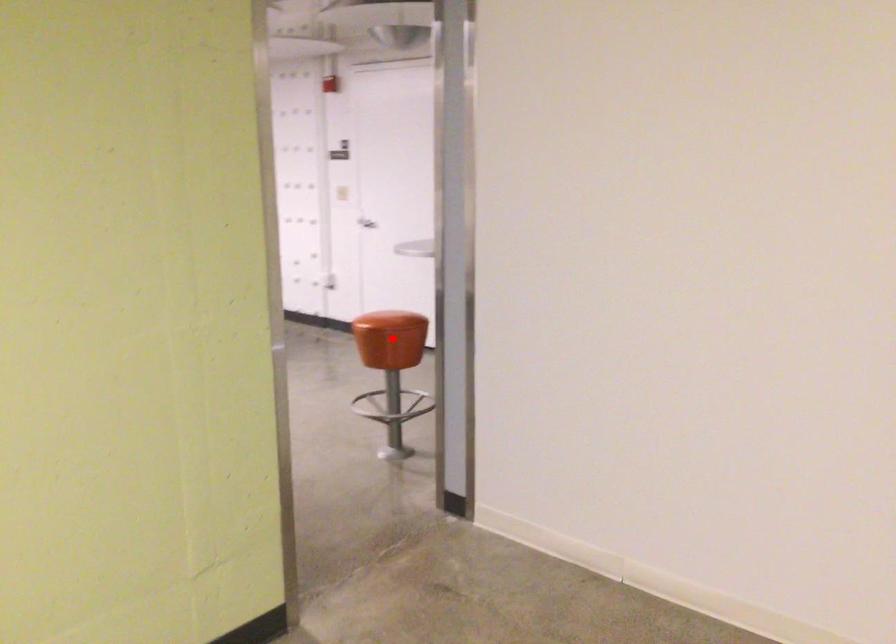
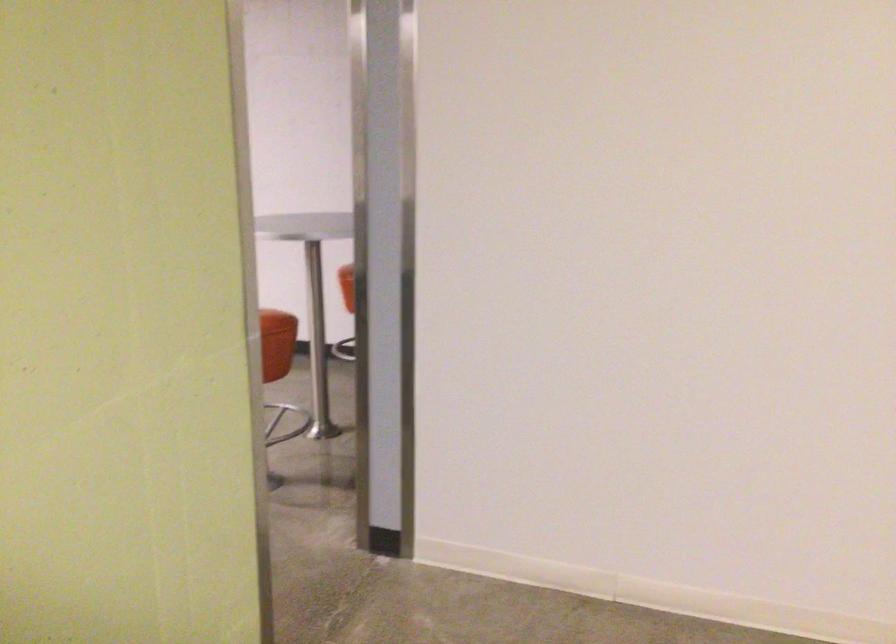
In the second image, find the point that corresponds to the highlighted location in the first image.

(277, 343)